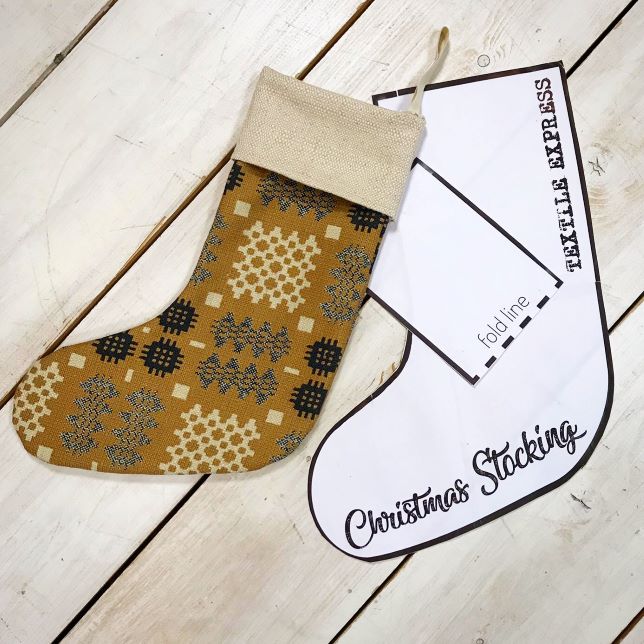
Locate an element on the screen. christmas stocking label is located at coordinates (408, 513), (518, 457).